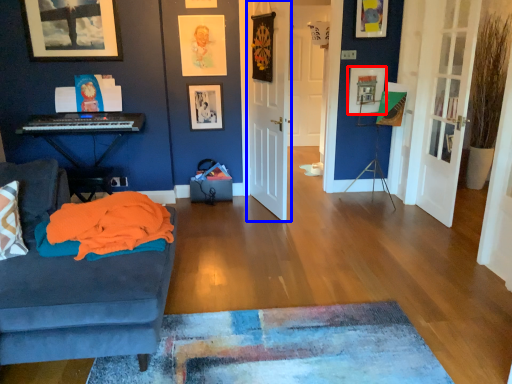
Question: Which of the following is the farthest to the observer, picture frame (highlighted by a red box) or door (highlighted by a blue box)?

Choices:
 (A) picture frame
 (B) door

Answer: (A)